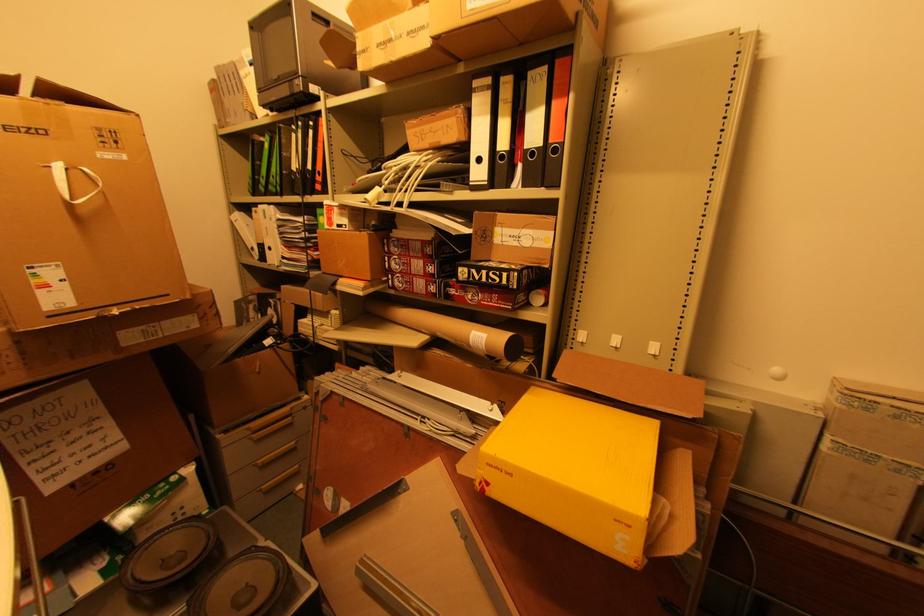
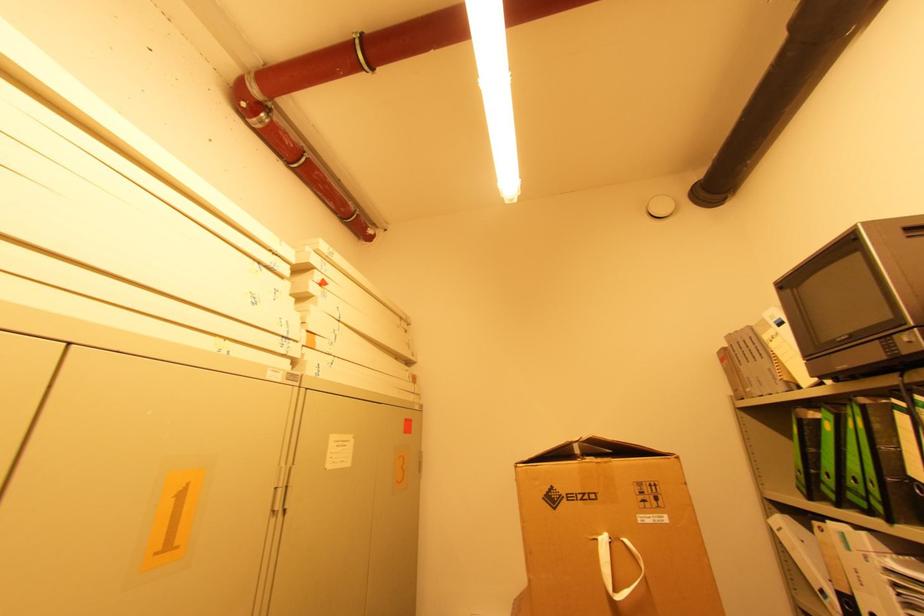
The point at (x=262, y=180) is marked in the first image. Where is the corresponding point in the second image?

(822, 476)